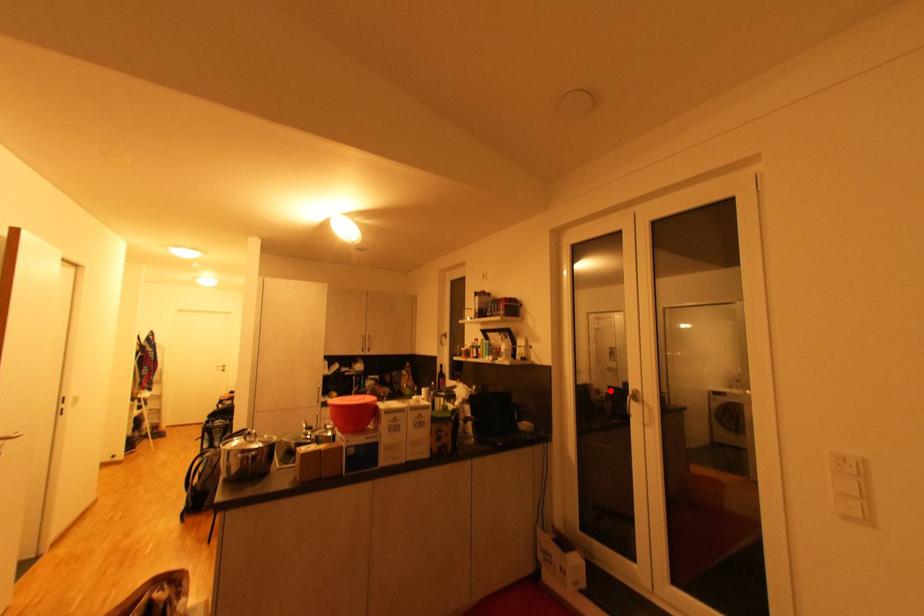
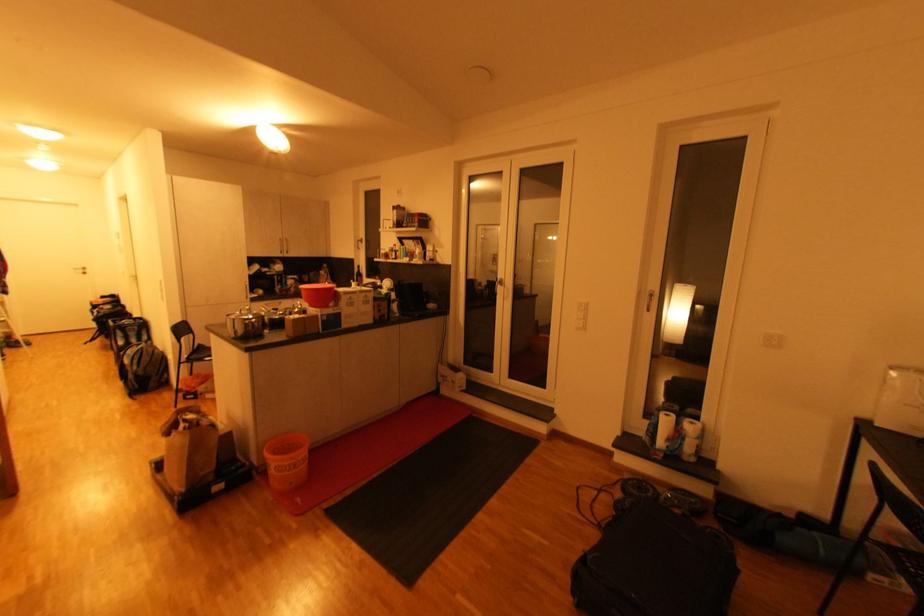
In the second image, find the point that corresponds to the highlighted location in the first image.

(490, 284)